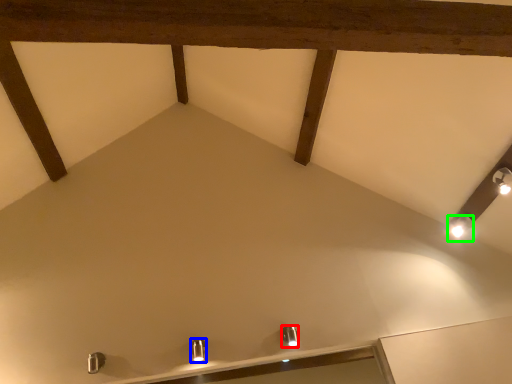
Question: Estimate the real-world distances between objects in this image. Which object is farther from light fixture (highlighted by a red box), light fixture (highlighted by a blue box) or light fixture (highlighted by a green box)?

Choices:
 (A) light fixture
 (B) light fixture

Answer: (B)